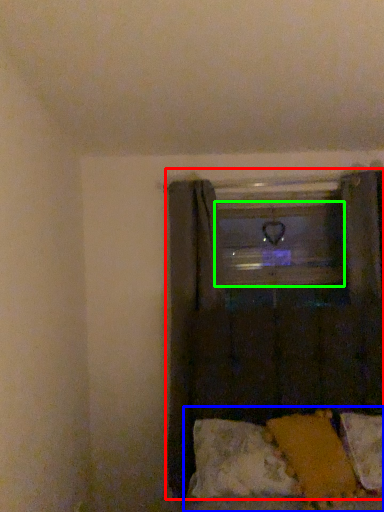
Question: Estimate the real-world distances between objects in this image. Which object is farther from curtain (highlighted by a red box), bed (highlighted by a blue box) or window frame (highlighted by a green box)?

Choices:
 (A) bed
 (B) window frame

Answer: (A)